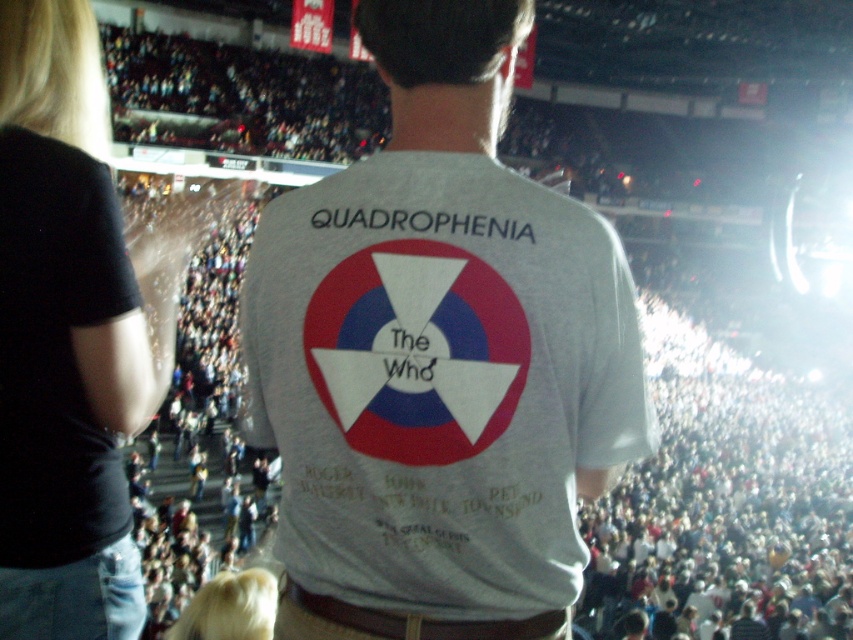
Which is below, white cotton t-shirt at center or black cotton shirt at upper left?

Positioned lower is black cotton shirt at upper left.

I want to click on white cotton t-shirt at center, so click(x=438, y=356).